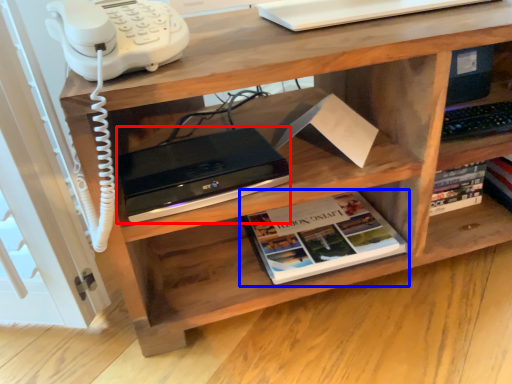
Question: Which object is further to the camera taking this photo, computer (highlighted by a red box) or book (highlighted by a blue box)?

Choices:
 (A) computer
 (B) book

Answer: (B)